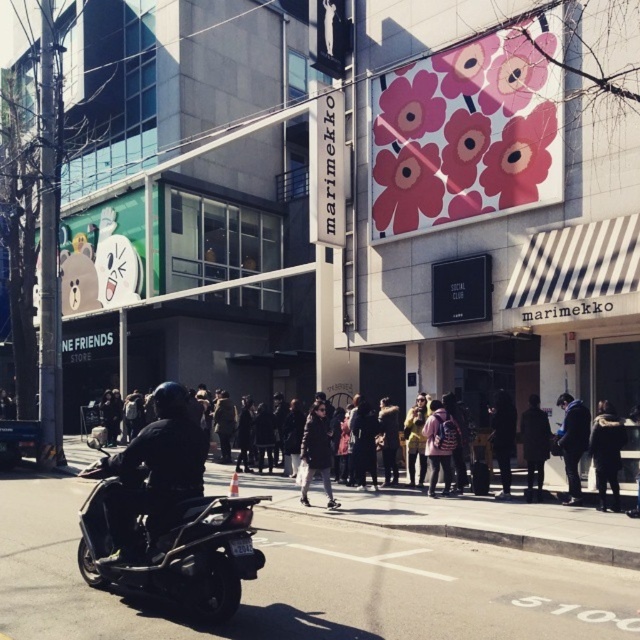
You are a delivery person needing to park your scooter in a designated area near the Marimekko advertisement. According to the scene, where exactly is the black matte scooter at lower left positioned relative to the Marimekko advertisement?

The black matte scooter at lower left is located at point (168, 541) relative to the Marimekko advertisement.

You are standing at point (545, 416) and want to walk to the Marimekko advertisement on the building. There is a person at point (132, 440) blocking your path. Can you walk around them to reach your destination?

Yes, you can walk around the person at point (132, 440) because they are in front of your current position at point (545, 416), so you can go around either side to reach the Marimekko advertisement.